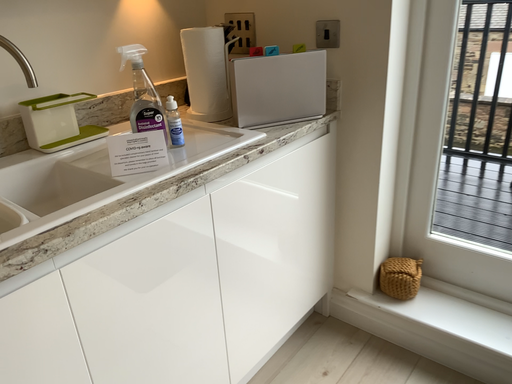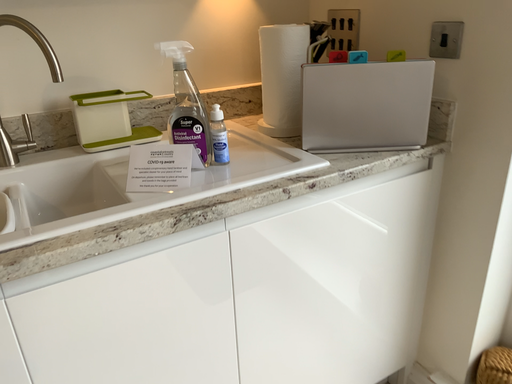
Question: Which way did the camera rotate in the video?

Choices:
 (A) rotated left
 (B) rotated right

Answer: (A)